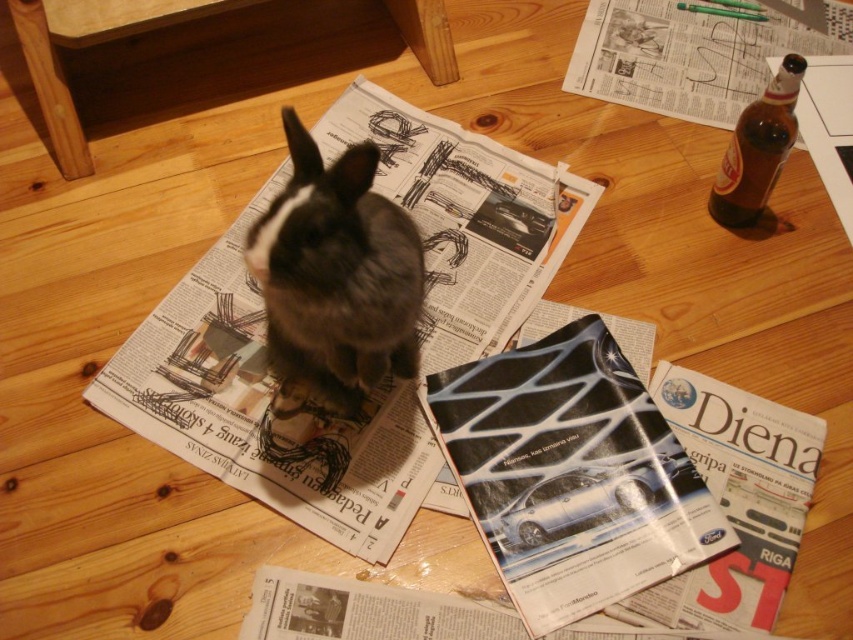
You are organizing a desk and need to place the matte black magazine at center and the white paper at upper right. Based on their sizes, which object should you place first if you want to ensure both fit on the desk without overlapping?

The matte black magazine at center is much taller than the white paper at upper right. Therefore, you should place the matte black magazine at center first to ensure there is enough space for both objects on the desk.

You are organizing a reading corner and need to arrange the white printed newspaper at center and the matte black magazine at center. According to their positions in the image, which one should you place in front to replicate the scene?

The white printed newspaper at center should be placed in front to replicate the scene since the matte black magazine at center is behind it in the original image.

What is located at the coordinates point [572,474]?

The point [572,474] has a matte black magazine at center.